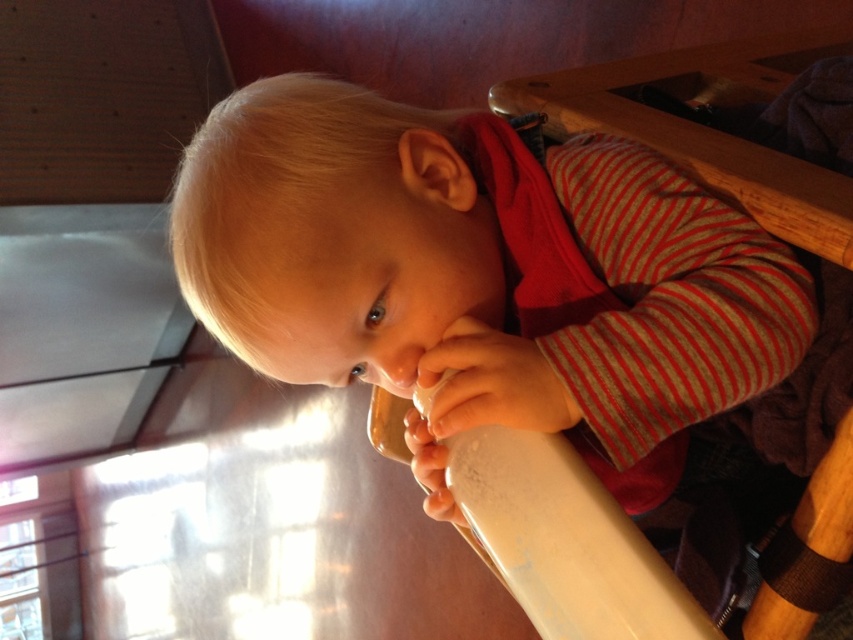
You are a parent trying to give your child a drink. The white plastic cup at center is on the high chair tray. Can the child reach the cup with their white matte hand at lower center?

The distance between the white plastic cup at center and the white matte hand at lower center is 16.79 centimeters, so the child can reach the cup if their hand can extend that distance.

You are a parent trying to give your child a drink. The child is sitting in a high chair with a white plastic cup at center and a smooth white hand at center. Which object is closer to the child when looking straight ahead?

The white plastic cup at center is closer to the child when looking straight ahead because it is positioned in front of the smooth white hand at center.

Based on the photo, you are a parent trying to give your child a drink. The white plastic cup at center is on the tray of the high chair, and the white matte hand at lower center belongs to the child. Can the child reach the cup without moving their hand from its current position?

The white plastic cup at center is much taller than the white matte hand at lower center, so the child may not be able to reach the cup without moving their hand since the cup is positioned higher up.